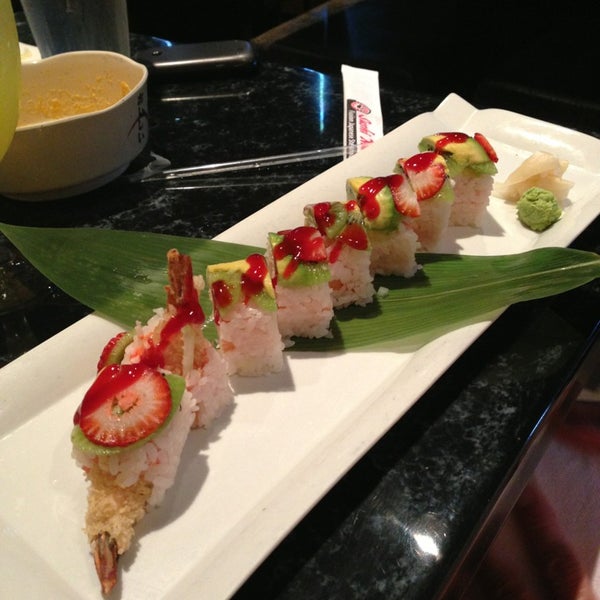
Locate an element on the screen. rectangular plate is located at coordinates (242, 479).